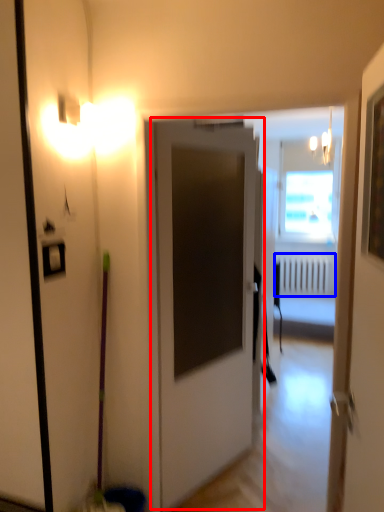
Question: Among these objects, which one is nearest to the camera, door (highlighted by a red box) or radiator (highlighted by a blue box)?

Choices:
 (A) door
 (B) radiator

Answer: (A)